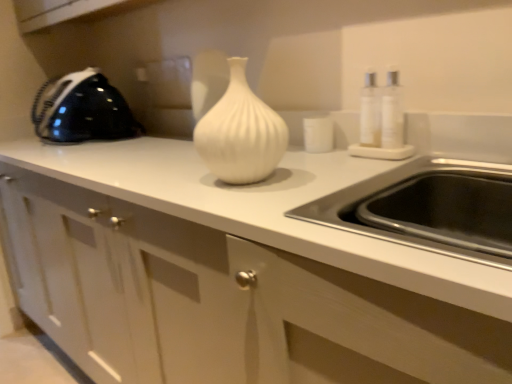
Question: In terms of width, does black glossy iron at left look wider or thinner when compared to white glossy vase at center?

Choices:
 (A) thin
 (B) wide

Answer: (B)

Question: From the image's perspective, is black glossy iron at left located above or below white glossy vase at center?

Choices:
 (A) above
 (B) below

Answer: (A)

Question: Which of these objects is positioned farthest from the black glossy iron at left?

Choices:
 (A) white glossy cabinet at center
 (B) white glossy vase at center

Answer: (B)

Question: Which object is the farthest from the white glossy vase at center?

Choices:
 (A) white glossy cabinet at center
 (B) black glossy iron at left

Answer: (B)